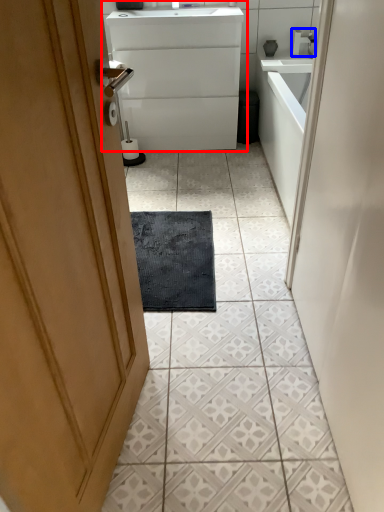
Question: Which object appears farthest to the camera in this image, bathroom cabinet (highlighted by a red box) or tap (highlighted by a blue box)?

Choices:
 (A) bathroom cabinet
 (B) tap

Answer: (B)